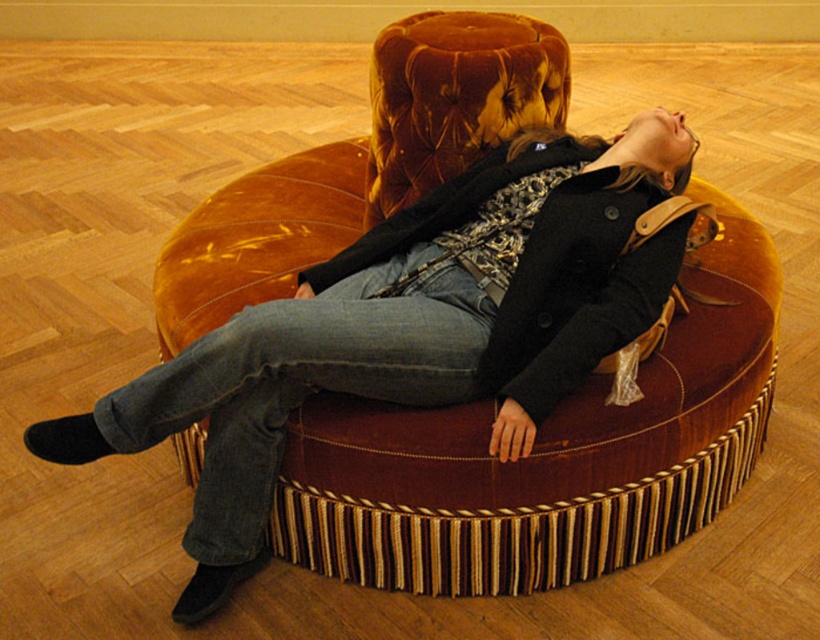
Question: Can you confirm if matte black coat at center is smaller than denim at center?

Choices:
 (A) no
 (B) yes

Answer: (A)

Question: Does matte black coat at center come behind denim at center?

Choices:
 (A) no
 (B) yes

Answer: (B)

Question: Is matte black coat at center wider than denim at center?

Choices:
 (A) no
 (B) yes

Answer: (B)

Question: Among these objects, which one is farthest from the camera?

Choices:
 (A) matte black coat at center
 (B) denim at center

Answer: (A)